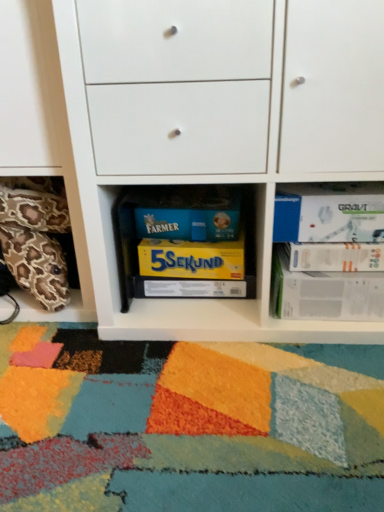
Find the location of `free space above white paper at right, the 2th paperback book in the bottom-to-top sequence (from a real-world perspective)`. free space above white paper at right, the 2th paperback book in the bottom-to-top sequence (from a real-world perspective) is located at coordinates (332, 268).